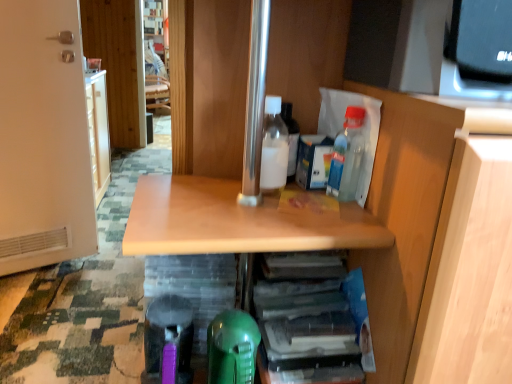
Question: Looking at their shapes, would you say translucent plastic bottle at upper right, which appears as the 1th bottle when viewed from the right, is wider or thinner than white matte door at left?

Choices:
 (A) wide
 (B) thin

Answer: (B)

Question: From a real-world perspective, is translucent plastic bottle at upper right, which appears as the 1th bottle when viewed from the right, above or below white matte door at left?

Choices:
 (A) above
 (B) below

Answer: (A)

Question: Which is farther from the white matte door at left?

Choices:
 (A) white matte bottle at center, which is the second bottle in right-to-left order
 (B) translucent plastic bottle at upper right, placed as the second bottle when sorted from left to right
 (C) translucent plastic stack of papers at lower center

Answer: (B)

Question: Based on their relative distances, which object is farther from the white matte door at left?

Choices:
 (A) white matte bottle at center, placed as the 1th bottle when sorted from left to right
 (B) translucent plastic stack of papers at lower center
 (C) translucent plastic bottle at upper right, placed as the second bottle when sorted from left to right

Answer: (C)